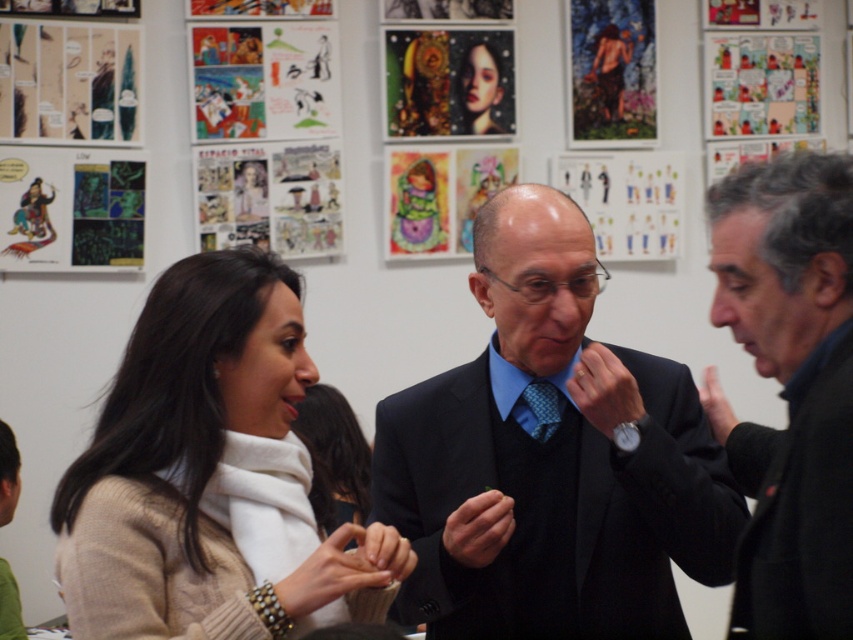
You are at an art exhibition and see two people wearing the beige sweater at left and the black wool jacket at right. Which person is standing closer to the front of the scene?

The beige sweater at left is positioned under the black wool jacket at right, meaning the person in the beige sweater at left is standing closer to the front of the scene.